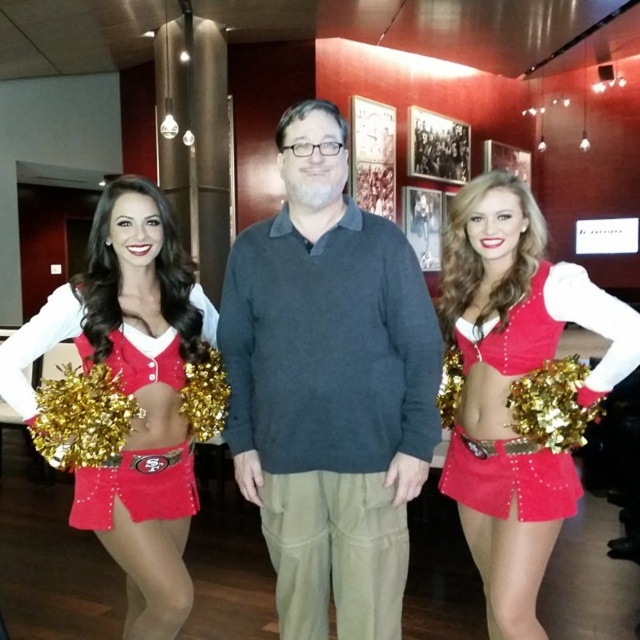
You are a photographer positioned in front of the two matte red cheerleaders. You want to take a photo that focuses on the matte red cheerleader at center without the matte red cheerleader at left being in the foreground. Is the current arrangement possible?

The matte red cheerleader at center is closer to the viewer than the matte red cheerleader at left, so yes, the current arrangement allows the photographer to focus on the matte red cheerleader at center while keeping the matte red cheerleader at left in the background.

You are a photographer setting up for a group photo in the hallway. You need to ensure both the matte red cheerleader at left and the matte red cheerleader outfit at right are clearly visible. Given their sizes, which one should you focus on first to ensure proper framing?

The matte red cheerleader at left is larger in size than the matte red cheerleader outfit at right, so you should focus on the matte red cheerleader at left first to ensure proper framing.